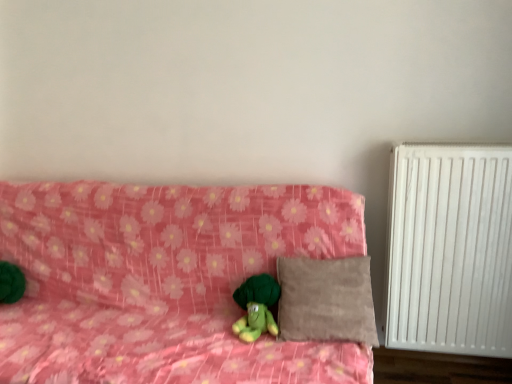
Question: From a real-world perspective, is pink floral fabric couch at center located higher than green plush toy at center?

Choices:
 (A) no
 (B) yes

Answer: (A)

Question: Can you confirm if pink floral fabric couch at center is thinner than green plush toy at center?

Choices:
 (A) no
 (B) yes

Answer: (A)

Question: Is there a large distance between pink floral fabric couch at center and green plush toy at center?

Choices:
 (A) yes
 (B) no

Answer: (B)

Question: Does pink floral fabric couch at center have a greater height compared to green plush toy at center?

Choices:
 (A) no
 (B) yes

Answer: (B)

Question: Is pink floral fabric couch at center not inside green plush toy at center?

Choices:
 (A) yes
 (B) no

Answer: (A)

Question: Would you say beige suede pillow at center is to the left or to the right of pink floral fabric couch at center in the picture?

Choices:
 (A) right
 (B) left

Answer: (A)

Question: From the image's perspective, is beige suede pillow at center above or below pink floral fabric couch at center?

Choices:
 (A) above
 (B) below

Answer: (A)

Question: Considering the positions of point (352, 319) and point (252, 211), is point (352, 319) closer or farther from the camera than point (252, 211)?

Choices:
 (A) closer
 (B) farther

Answer: (A)

Question: Based on their sizes in the image, would you say beige suede pillow at center is bigger or smaller than pink floral fabric couch at center?

Choices:
 (A) big
 (B) small

Answer: (B)

Question: From a real-world perspective, relative to white matte radiator at right, is beige suede pillow at center vertically above or below?

Choices:
 (A) below
 (B) above

Answer: (A)

Question: Considering the positions of point (334, 296) and point (432, 162), is point (334, 296) closer or farther from the camera than point (432, 162)?

Choices:
 (A) farther
 (B) closer

Answer: (B)

Question: In the image, is beige suede pillow at center positioned in front of or behind white matte radiator at right?

Choices:
 (A) front
 (B) behind

Answer: (A)

Question: Visually, is beige suede pillow at center positioned to the left or to the right of white matte radiator at right?

Choices:
 (A) left
 (B) right

Answer: (A)

Question: From the image's perspective, is green plush toy at center located above or below pink floral fabric couch at center?

Choices:
 (A) above
 (B) below

Answer: (A)

Question: Is green plush toy at center in front of or behind pink floral fabric couch at center in the image?

Choices:
 (A) behind
 (B) front

Answer: (A)